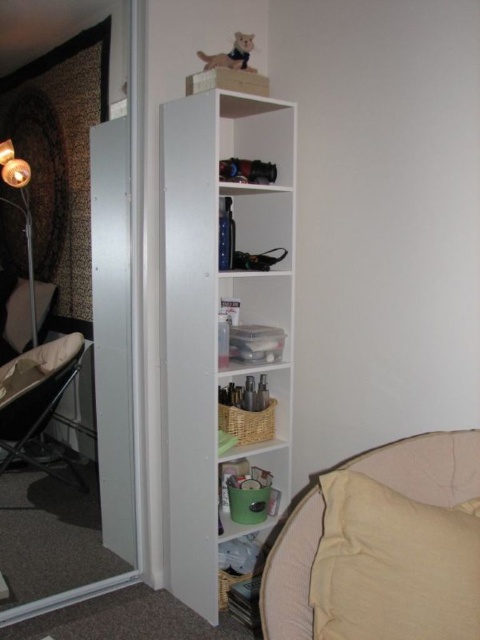
Question: Which point is farther to the camera?

Choices:
 (A) (34, 465)
 (B) (257, 100)
 (C) (356, 584)
 (D) (31, 291)

Answer: (A)

Question: Does white matte bookshelf at center appear under metallic silver folding chair at left?

Choices:
 (A) yes
 (B) no

Answer: (B)

Question: In this image, where is beige fabric pillow at lower right located relative to metallic silver folding chair at left?

Choices:
 (A) above
 (B) below

Answer: (B)

Question: Considering the real-world distances, which object is farthest from the matte gold lamp at left?

Choices:
 (A) white matte bookshelf at center
 (B) beige fabric pillow at lower right
 (C) metallic silver folding chair at left

Answer: (B)

Question: Does beige fabric pillow at lower right have a greater width compared to matte gold lamp at left?

Choices:
 (A) yes
 (B) no

Answer: (A)

Question: Which point is farther to the camera?

Choices:
 (A) (14, 173)
 (B) (64, 358)
 (C) (164, 525)
 (D) (437, 604)

Answer: (B)